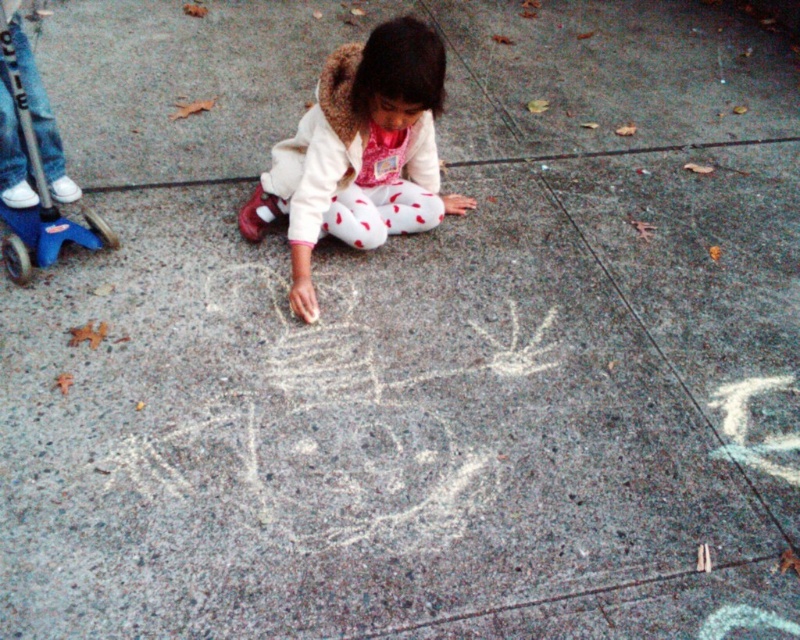
You are a parent supervising your child. You notice the white chalk drawing at center and the blue rubber glove at upper left. Which object is bigger in size?

The white chalk drawing at center is larger in size compared to the blue rubber glove at upper left.

You are a parent watching your child draw on the ground. You notice a point at coordinates (326, 424). What is located at that point?

The point at coordinates (326, 424) is where the white chalk drawing at center is located.